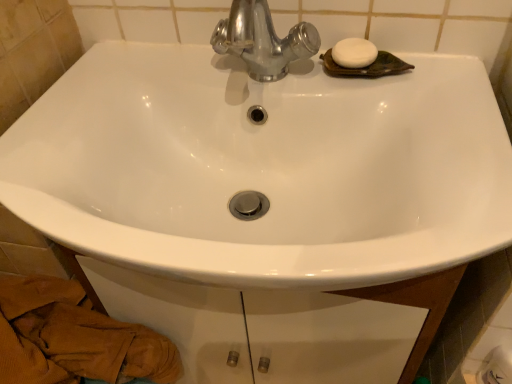
Locate an element on the screen. Image resolution: width=512 pixels, height=384 pixels. vacant area that lies to the right of white matte soap at upper right is located at coordinates (446, 70).